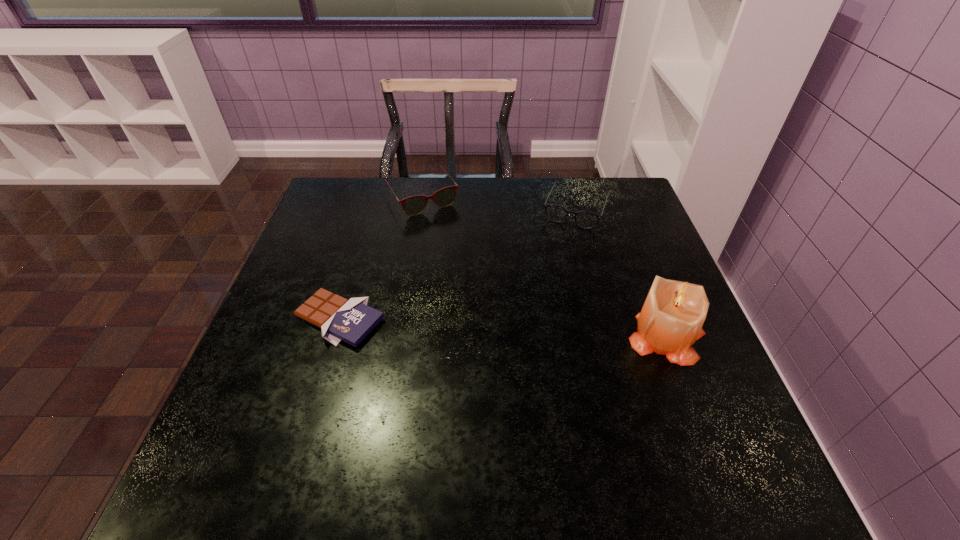
You are a GUI agent. You are given a task and a screenshot of the screen. Output one action in this format:
    pyautogui.click(x=<x>, y=<y>)
    Task: Click on the vacant region between the chocolate bar and the left spectacles
    
    Given the screenshot: What is the action you would take?
    pyautogui.click(x=380, y=258)

At what (x,y) coordinates should I click in order to perform the action: click on vacant space in between the right spectacles and the candle. Please return your answer as a coordinate pair (x, y). This screenshot has height=540, width=960. Looking at the image, I should click on (622, 273).

This screenshot has width=960, height=540. I want to click on the second closest object relative to the right spectacles, so click(671, 319).

The width and height of the screenshot is (960, 540). Identify the location of object that is the second closest to the tallest object. (414, 205).

You are a GUI agent. You are given a task and a screenshot of the screen. Output one action in this format:
    pyautogui.click(x=<x>, y=<y>)
    Task: Click on the free point that satisfies the following two spatial constraints: 1. on the front side of the chocolate bar; 2. on the left side of the candle
    
    Given the screenshot: What is the action you would take?
    pyautogui.click(x=334, y=338)

This screenshot has width=960, height=540. Identify the location of vacant space that satisfies the following two spatial constraints: 1. on the back side of the chocolate bar; 2. on the left side of the right spectacles. (372, 208).

Locate an element on the screen. free spot that satisfies the following two spatial constraints: 1. on the front side of the left spectacles; 2. on the left side of the right spectacles is located at coordinates (420, 208).